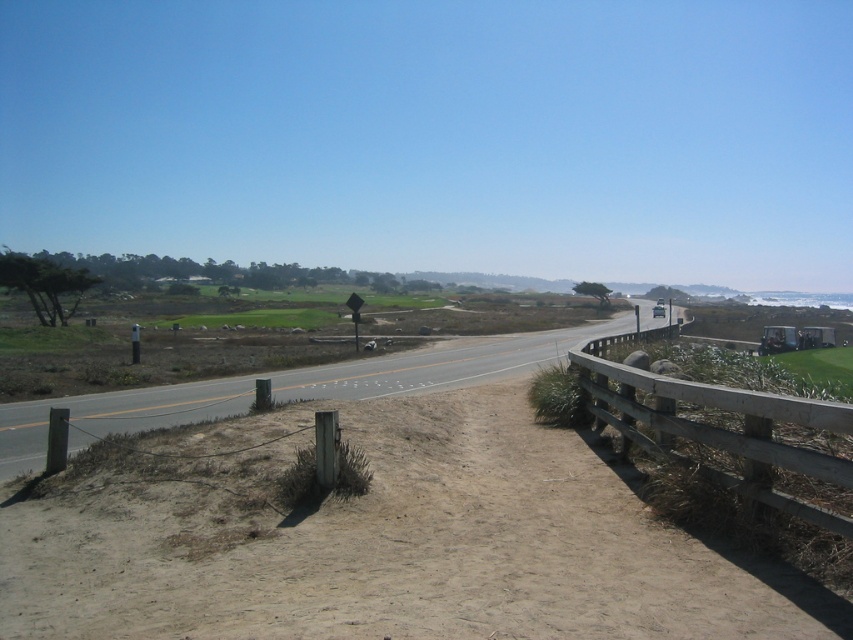
You are driving a car that is 1.8 meters wide. You need to cross a narrow bridge ahead. The bridge is part of the asphalt road at center, and the wooden fence at right is the closest obstacle. Can your car safely pass through the bridge if the bridge has no other vehicles?

The wooden fence at right is 12.05 meters away from asphalt road at center. Since the distance between them is much larger than the car width of 1.8 meters, the car can safely pass through the bridge without any issues.